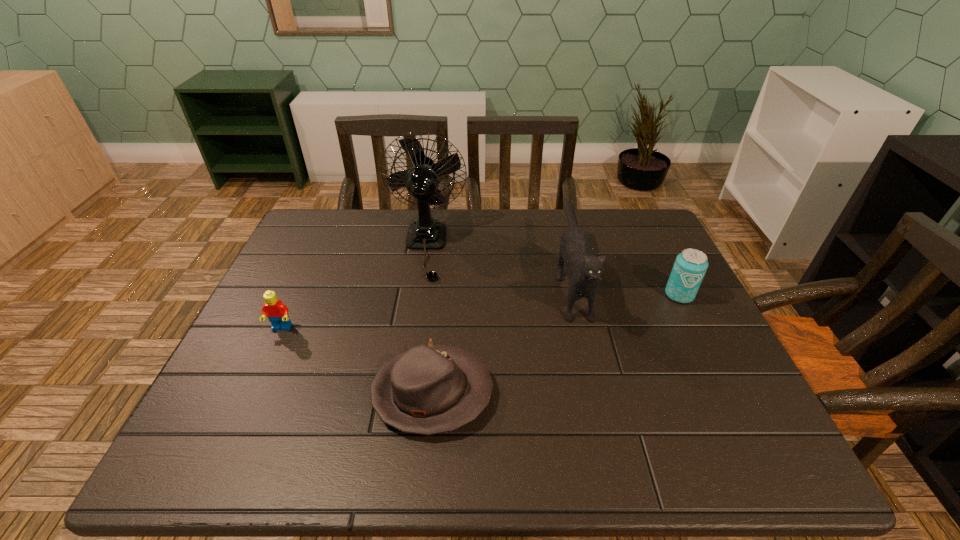
The height and width of the screenshot is (540, 960). Identify the location of blank space located 0.150m on the face of the Lego. (255, 387).

Identify the location of free location located 0.150m on the decorative side of the hat. (564, 393).

At what (x,y) coordinates should I click in order to perform the action: click on fan that is at the far edge. Please return your answer as a coordinate pair (x, y). Looking at the image, I should click on (427, 233).

Locate an element on the screen. cat present at the far edge is located at coordinates (585, 269).

Find the location of a particular element. This screenshot has height=540, width=960. object situated at the near edge is located at coordinates (x=427, y=390).

At what (x,y) coordinates should I click in order to perform the action: click on object that is at the left edge. Please return your answer as a coordinate pair (x, y). Image resolution: width=960 pixels, height=540 pixels. Looking at the image, I should click on (277, 312).

Find the location of a particular element. The height and width of the screenshot is (540, 960). object positioned at the right edge is located at coordinates (690, 266).

Find the location of a particular element. The image size is (960, 540). free region at the far edge of the desktop is located at coordinates (465, 230).

In the image, there is a desktop. Identify the location of vacant space at the near edge. This screenshot has height=540, width=960. (359, 429).

This screenshot has height=540, width=960. What are the coordinates of `vacant region at the left edge` in the screenshot? It's located at (333, 275).